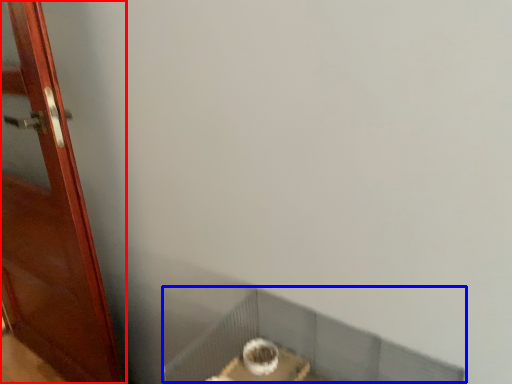
Question: Among these objects, which one is nearest to the camera, door (highlighted by a red box) or window sill (highlighted by a blue box)?

Choices:
 (A) door
 (B) window sill

Answer: (B)